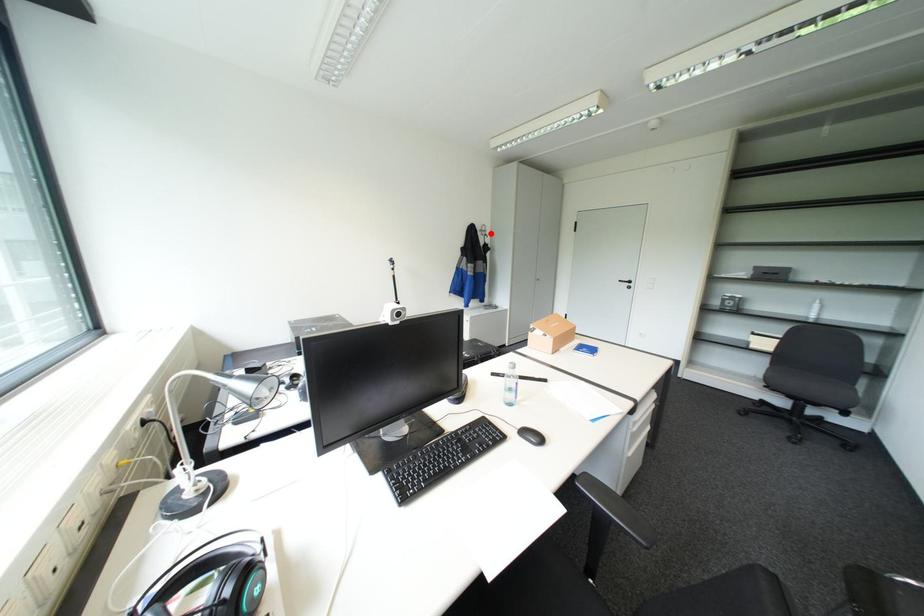
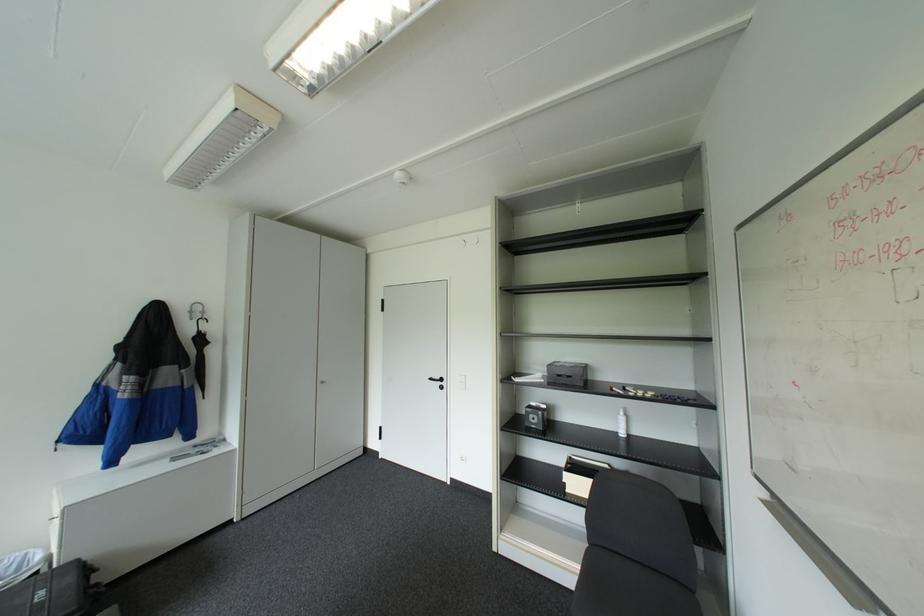
Question: A red point is marked in image1. In image2, is the corresponding 3D point closer to the camera or farther? Reply with the corresponding letter.

Choices:
 (A) The corresponding 3D point is closer.
 (B) The corresponding 3D point is farther.

Answer: (B)